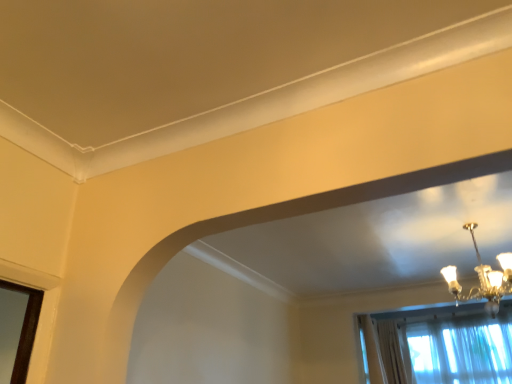
Measure the distance between point (x=508, y=253) and camera.

They are 9.92 feet apart.

The image size is (512, 384). I want to click on gold metallic chandelier at upper right, so click(483, 279).

This screenshot has width=512, height=384. Describe the element at coordinates (483, 279) in the screenshot. I see `gold metallic chandelier at upper right` at that location.

The width and height of the screenshot is (512, 384). In order to click on gold metallic chandelier at upper right in this screenshot , I will do `click(483, 279)`.